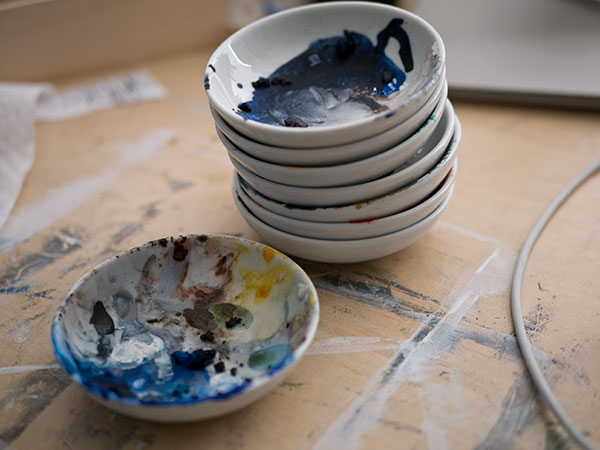
At what (x,y) coordinates should I click in order to perform the action: click on light reflection in bowl. Please return your answer as a coordinate pair (x, y). The image size is (600, 450). Looking at the image, I should click on (235, 58).